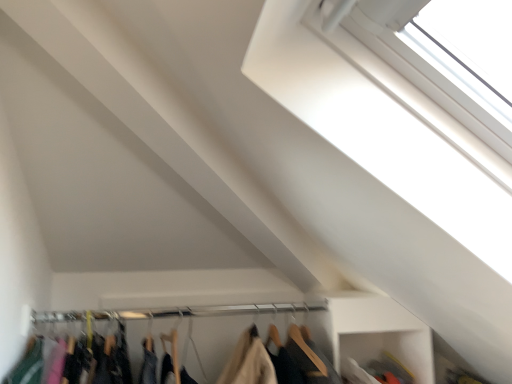
Question: Does white plastic window at upper right have a larger size compared to wooden hangers at lower center?

Choices:
 (A) no
 (B) yes

Answer: (B)

Question: Is white plastic window at upper right closer to camera compared to wooden hangers at lower center?

Choices:
 (A) yes
 (B) no

Answer: (A)

Question: From the image's perspective, would you say white plastic window at upper right is positioned over wooden hangers at lower center?

Choices:
 (A) yes
 (B) no

Answer: (A)

Question: Is white plastic window at upper right at the left side of wooden hangers at lower center?

Choices:
 (A) no
 (B) yes

Answer: (A)

Question: Is white plastic window at upper right to the right of wooden hangers at lower center from the viewer's perspective?

Choices:
 (A) yes
 (B) no

Answer: (A)

Question: Is white plastic window at upper right behind wooden hangers at lower center?

Choices:
 (A) no
 (B) yes

Answer: (A)

Question: Is metallic silver clothesline at center positioned in front of wooden hangers at lower center?

Choices:
 (A) no
 (B) yes

Answer: (A)

Question: Is metallic silver clothesline at center not near wooden hangers at lower center?

Choices:
 (A) yes
 (B) no

Answer: (B)

Question: Is metallic silver clothesline at center placed right next to wooden hangers at lower center?

Choices:
 (A) no
 (B) yes

Answer: (B)

Question: Can wooden hangers at lower center be found inside metallic silver clothesline at center?

Choices:
 (A) no
 (B) yes

Answer: (A)

Question: Does metallic silver clothesline at center have a smaller size compared to wooden hangers at lower center?

Choices:
 (A) yes
 (B) no

Answer: (A)

Question: Can you confirm if metallic silver clothesline at center is bigger than wooden hangers at lower center?

Choices:
 (A) no
 (B) yes

Answer: (A)

Question: Is wooden hangers at lower center positioned in front of metallic silver clothesline at center?

Choices:
 (A) yes
 (B) no

Answer: (A)